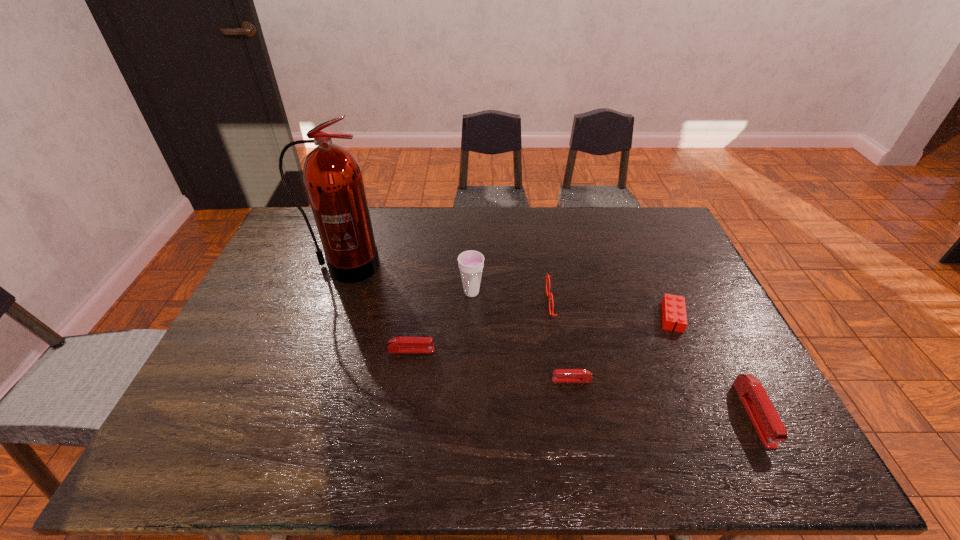
Where is `free point that keeps the staplers evenly spaced on the left`? free point that keeps the staplers evenly spaced on the left is located at coordinates (269, 323).